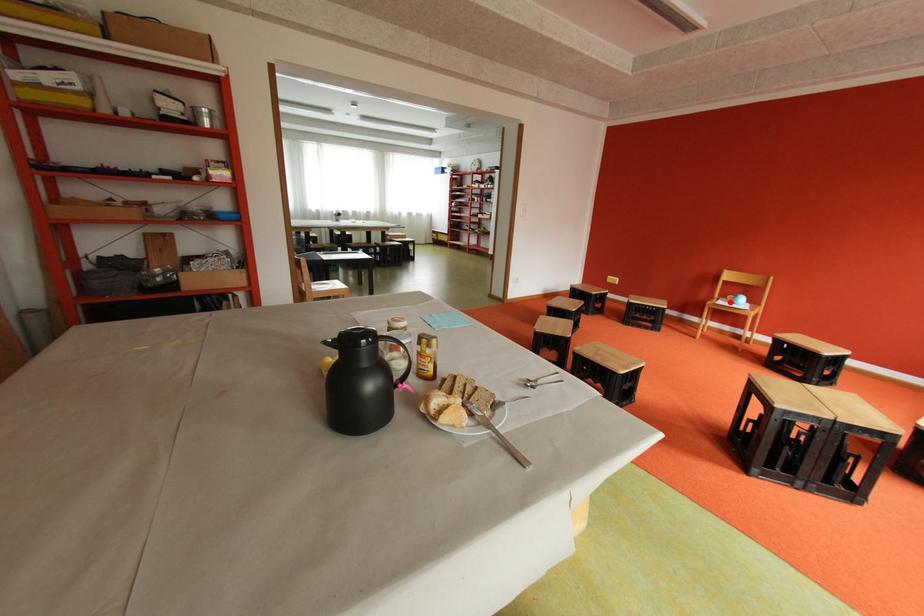
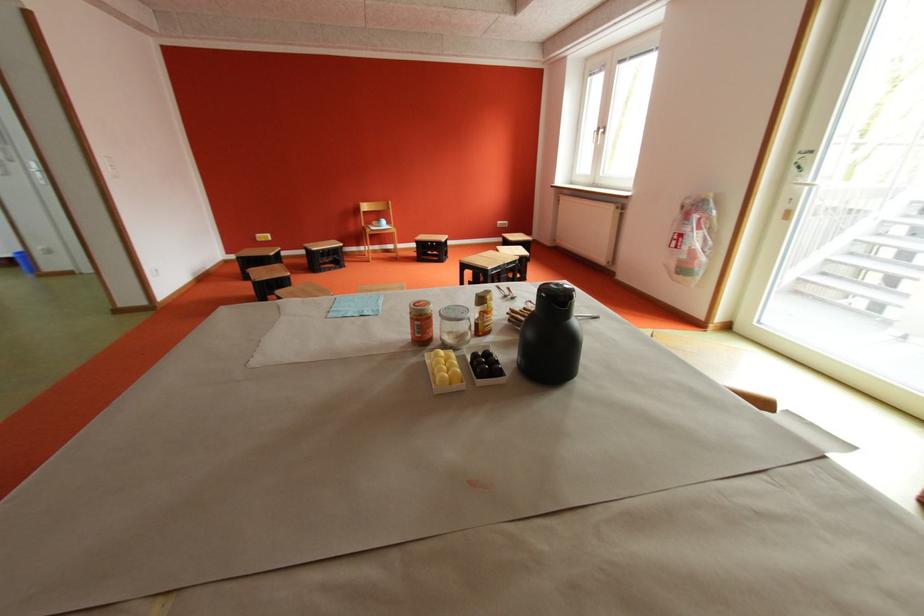
Question: I am providing you with two images of the same scene from different viewpoints. A red point is shown in image1. For the corresponding object point in image2, is it positioned nearer or farther from the camera?

Choices:
 (A) Nearer
 (B) Farther

Answer: (A)